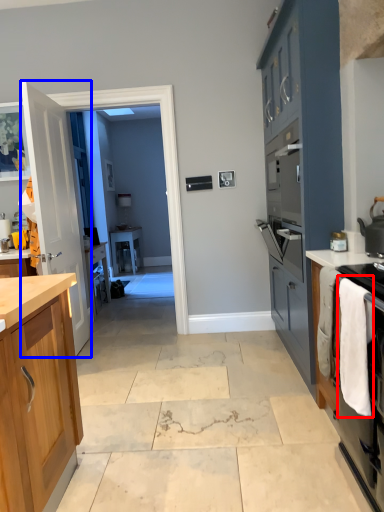
Question: Which point is closer to the camera, laundry (highlighted by a red box) or door (highlighted by a blue box)?

Choices:
 (A) laundry
 (B) door

Answer: (A)